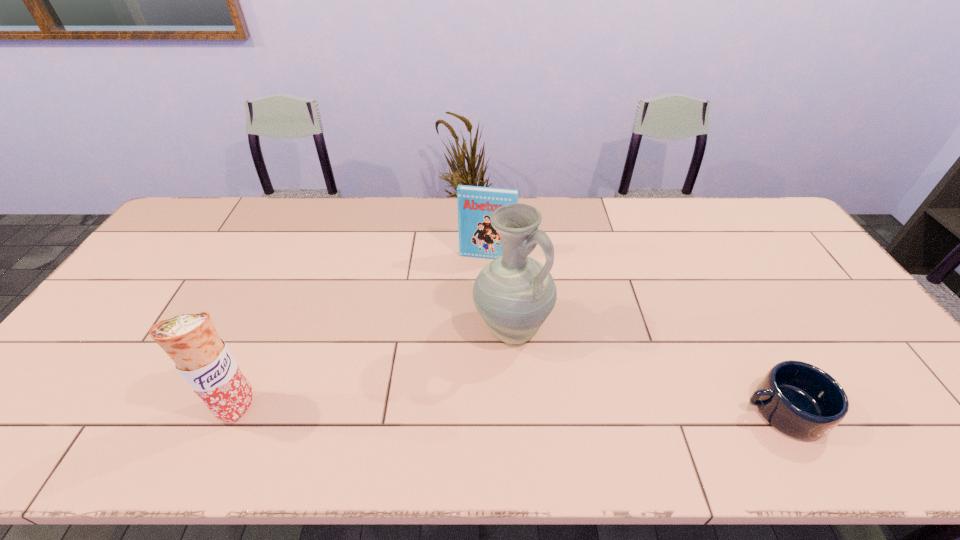
I want to click on vacant space at the far edge, so click(596, 232).

I want to click on vacant space at the near edge of the desktop, so [x=589, y=389].

This screenshot has width=960, height=540. In the image, there is a desktop. Find the location of `vacant space at the left edge`. vacant space at the left edge is located at coordinates (180, 239).

Locate an element on the screen. free space at the right edge of the desktop is located at coordinates (843, 314).

You are a GUI agent. You are given a task and a screenshot of the screen. Output one action in this format:
    pyautogui.click(x=<x>, y=<y>)
    Task: Click on the free space at the far left corner of the desktop
    The width and height of the screenshot is (960, 540).
    Given the screenshot: What is the action you would take?
    pyautogui.click(x=216, y=199)

The height and width of the screenshot is (540, 960). I want to click on free region at the near left corner of the desktop, so click(51, 380).

You are a GUI agent. You are given a task and a screenshot of the screen. Output one action in this format:
    pyautogui.click(x=<x>, y=<y>)
    Task: Click on the unoccupied area between the rightmost object and the pitcher
    The height and width of the screenshot is (540, 960).
    Given the screenshot: What is the action you would take?
    [x=647, y=370]

Find the location of a particular element. vacant area between the leftmost object and the mug is located at coordinates (510, 408).

You are a GUI agent. You are given a task and a screenshot of the screen. Output one action in this format:
    pyautogui.click(x=<x>, y=<y>)
    Task: Click on the free point between the farthest object and the rightmost object
    The height and width of the screenshot is (540, 960).
    Given the screenshot: What is the action you would take?
    pyautogui.click(x=635, y=333)

Identify the location of free space between the tallest object and the rightmost object. This screenshot has width=960, height=540. (647, 370).